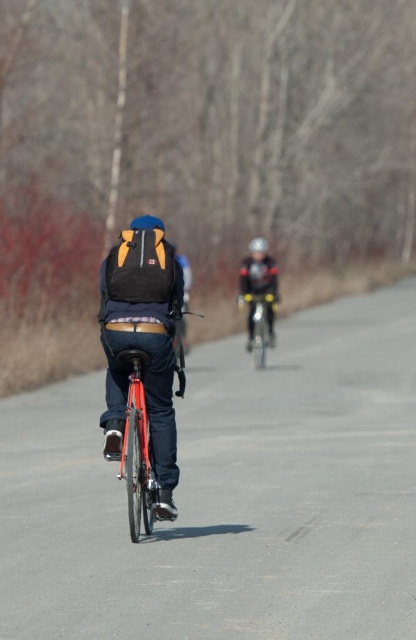
You are a delivery person who needs to park your metallic silver bicycle at center near the road. Based on the scene, where would be the most appropriate spot to park it?

The most appropriate spot to park the metallic silver bicycle at center would be near the road where it is positioned at point (259,324), ensuring it stays visible and accessible while adhering to the scene layout.

You are planning to transport both the metallic silver bicycle at center and the matte black helmet at center in the trunk of your car. Which item should you place first to maximize space efficiency?

Since the metallic silver bicycle at center occupies less space than the matte black helmet at center, you should place the matte black helmet at center first to allow the smaller metallic silver bicycle at center to fit into any remaining gaps.

You are a photographer planning to take a group photo of the cyclists wearing the shiny black helmet at center and the matte black helmet at center. If you want to ensure both helmets are clearly visible in the photo, which helmet should you focus on first due to its size?

The shiny black helmet at center is narrower than the matte black helmet at center, so you should focus on the matte black helmet at center first because it is wider and more visible.